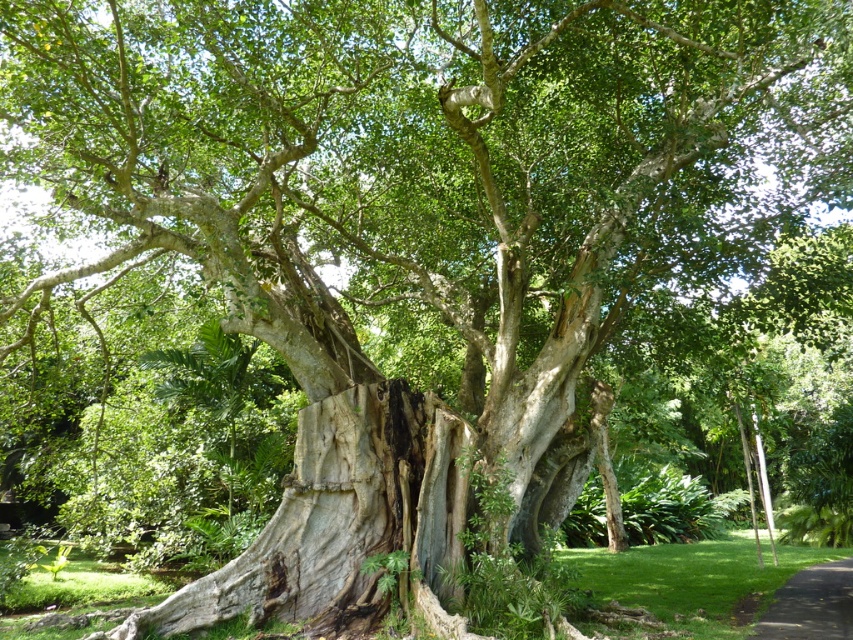
You are a gardener planning to plant a new flower bed along the black asphalt path at lower right. Considering the gray rough bark tree trunk at center, what potential issue should you be aware of?

The gray rough bark tree trunk at center is positioned over the black asphalt path at lower right, so the tree roots might interfere with the path or the flower bed, causing potential damage or obstruction.

You are a gardener trying to place a new decorative stone path next to the gray rough bark tree trunk at center and the black asphalt path at lower right. Which object is narrower so that the path can be placed on its side?

The gray rough bark tree trunk at center is thinner than the black asphalt path at lower right, so the path can be placed next to the gray rough bark tree trunk at center since it is narrower.

In the scene shown: You are a gardener planning to install a new sprinkler system around the gray rough bark tree trunk at center and the black asphalt path at lower right. Considering their sizes, which object requires a larger area for the sprinkler coverage?

The black asphalt path at lower right requires a larger area for the sprinkler coverage since it is bigger than the gray rough bark tree trunk at center.